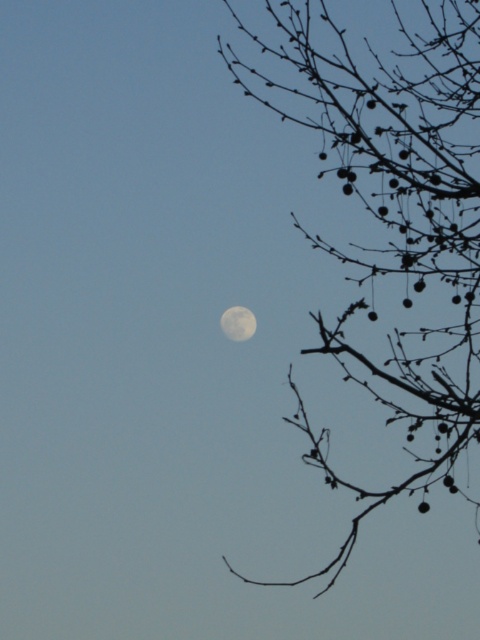
Question: Can you confirm if silvery bark branches at right is smaller than white matte moon at upper right?

Choices:
 (A) yes
 (B) no

Answer: (B)

Question: Is silvery bark branches at right in front of white matte moon at upper right?

Choices:
 (A) no
 (B) yes

Answer: (B)

Question: Which point is closer to the camera?

Choices:
 (A) white matte moon at upper right
 (B) silvery bark branches at right

Answer: (B)

Question: Is silvery bark branches at right further to camera compared to white matte moon at upper right?

Choices:
 (A) yes
 (B) no

Answer: (B)